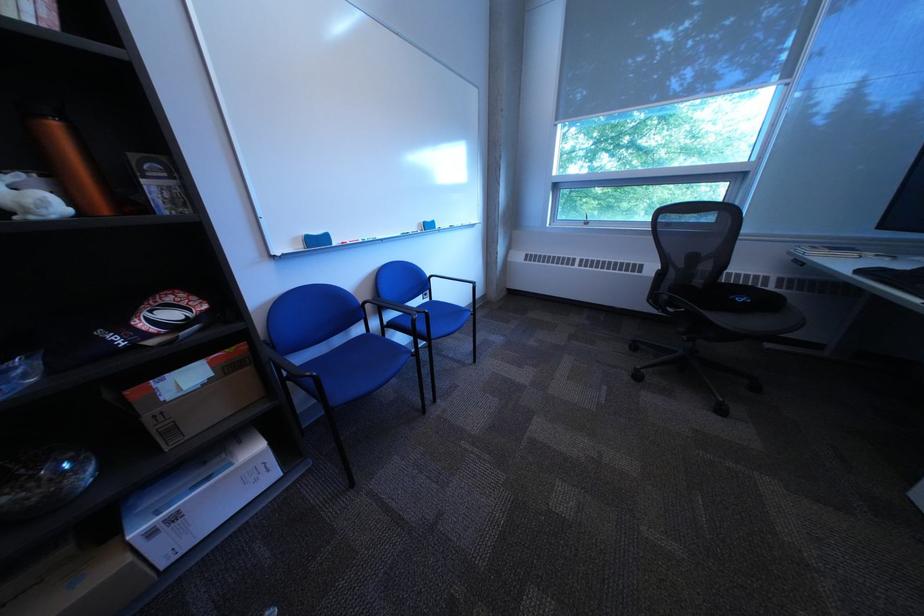
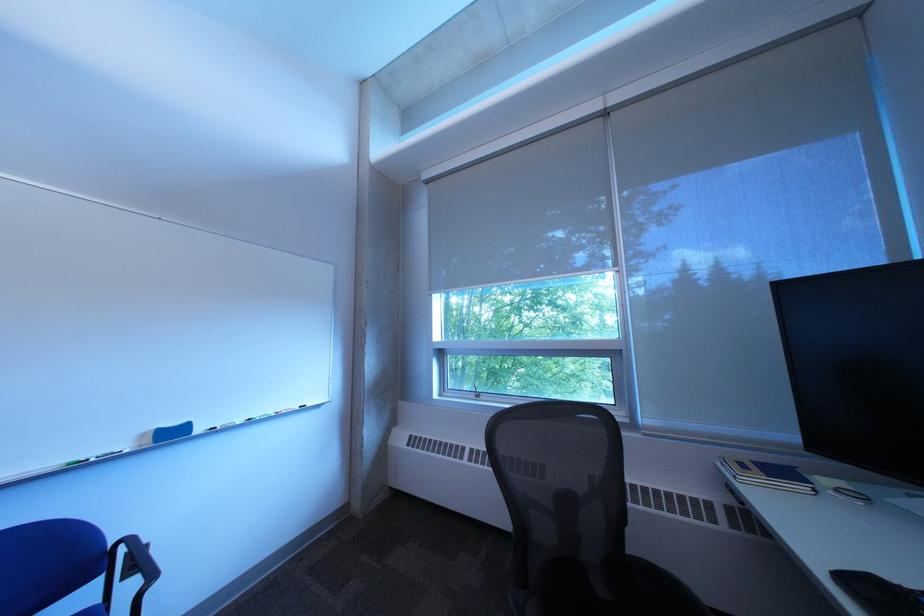
In the second image, find the point that corresponds to point (877, 274) in the first image.

(860, 582)